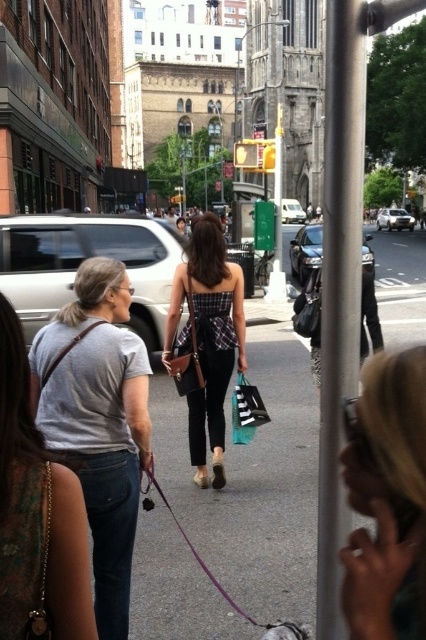
You are standing at the point labeled point (x=322, y=630) and want to move to the point labeled point (x=196, y=460). Which direction should you move to get closer to your destination?

To move from point (x=322, y=630) to point (x=196, y=460), you should move towards the lower left direction since point (x=196, y=460) is farther from the camera compared to point (x=322, y=630).

You are a photographer trying to capture a candid shot of the two women in the scene. You want to ensure that the blonde hair at upper right and the metallic gray pole at center are both in the frame. Based on their positions, which object should you position closer to the left side of your camera viewfinder?

The blonde hair at upper right should be positioned closer to the left side of the camera viewfinder because it is located to the left of the metallic gray pole at center.